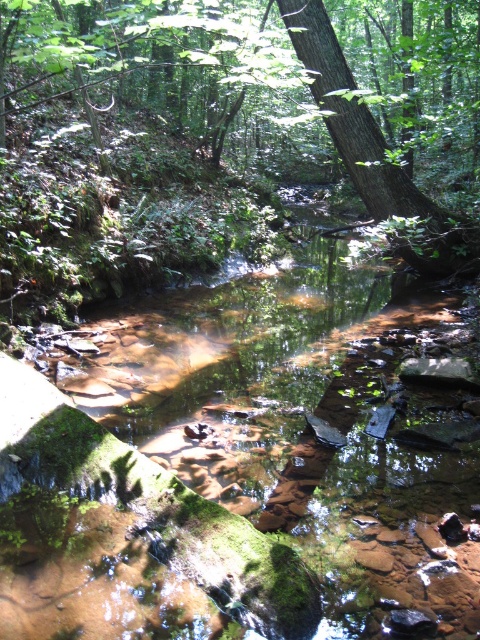
Question: Does clear water at center have a larger size compared to green leafy tree at center?

Choices:
 (A) yes
 (B) no

Answer: (B)

Question: Which is nearer to the green leafy tree at center?

Choices:
 (A) clear water at center
 (B) green rough bark tree at center

Answer: (B)

Question: Based on their relative distances, which object is nearer to the clear water at center?

Choices:
 (A) green rough bark tree at center
 (B) green leafy tree at center

Answer: (A)

Question: Does clear water at center appear under green leafy tree at center?

Choices:
 (A) no
 (B) yes

Answer: (B)

Question: Is green leafy tree at center further to the viewer compared to green rough bark tree at center?

Choices:
 (A) no
 (B) yes

Answer: (A)

Question: Which point appears closest to the camera in this image?

Choices:
 (A) (332, 369)
 (B) (224, 42)

Answer: (B)